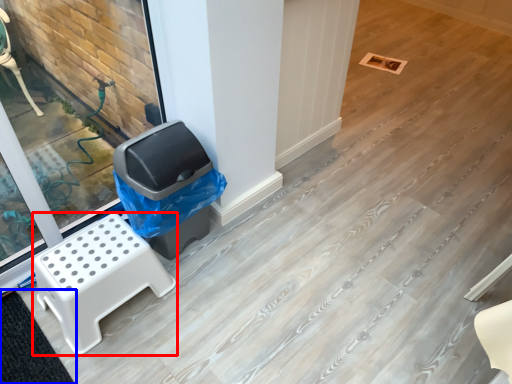
Question: Which object appears closest to the camera in this image, furniture (highlighted by a red box) or mat (highlighted by a blue box)?

Choices:
 (A) furniture
 (B) mat

Answer: (B)